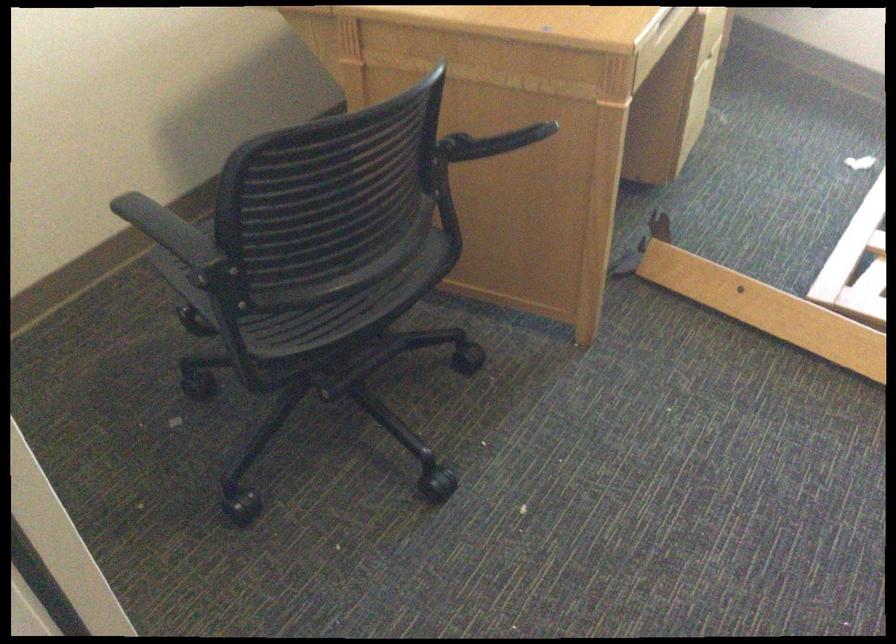
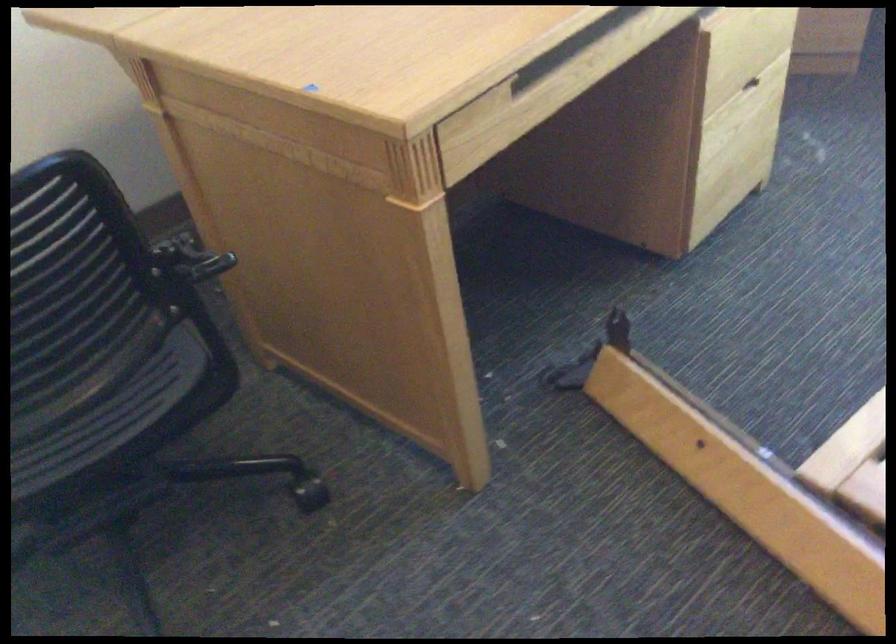
The images are taken continuously from a first-person perspective. In which direction are you moving?

The movement direction of the cameraman is right, forward.